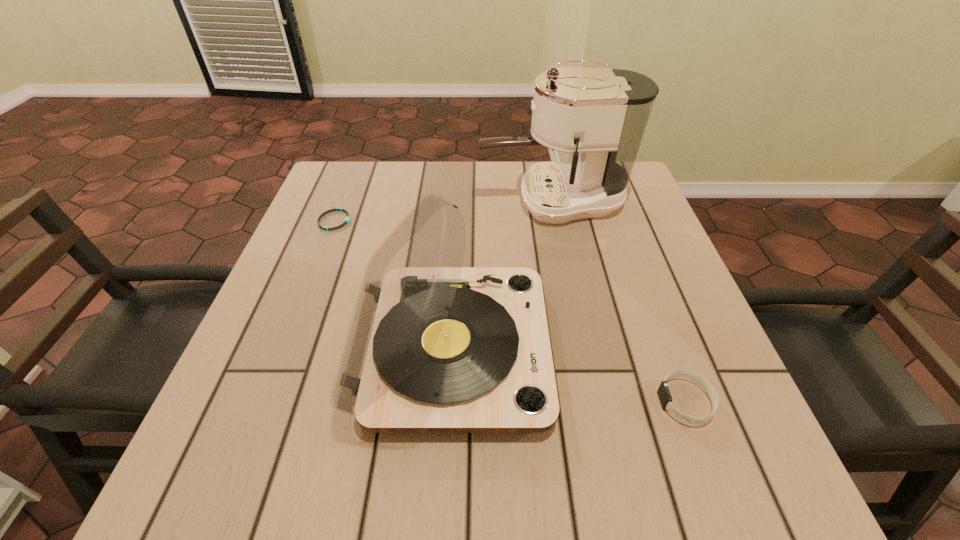
The height and width of the screenshot is (540, 960). In order to click on the tallest object in this screenshot , I will do `click(600, 115)`.

What are the coordinates of `the third shortest object` in the screenshot? It's located at (433, 347).

Find the location of a particular element. Image resolution: width=960 pixels, height=540 pixels. the nearer wristband is located at coordinates (663, 391).

In order to click on the second shortest object in this screenshot , I will do `click(663, 391)`.

I want to click on the left wristband, so click(347, 219).

Locate an element on the screen. the leftmost object is located at coordinates (347, 219).

Where is `free space located 0.180m on the front-facing side of the coffee maker`? This screenshot has width=960, height=540. free space located 0.180m on the front-facing side of the coffee maker is located at coordinates (409, 201).

Locate an element on the screen. This screenshot has height=540, width=960. free region located 0.150m on the front-facing side of the coffee maker is located at coordinates (420, 201).

The height and width of the screenshot is (540, 960). Identify the location of free region located on the front-facing side of the coffee maker. (362, 201).

Locate an element on the screen. vacant point located with the tonearm facing the front of the record player is located at coordinates (608, 348).